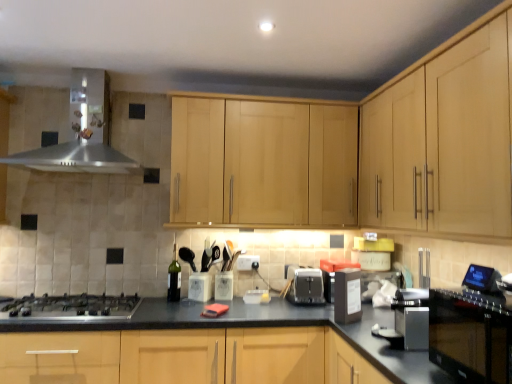
I want to click on empty space that is ontop of stainless steel range hood at upper left (from a real-world perspective), so click(69, 58).